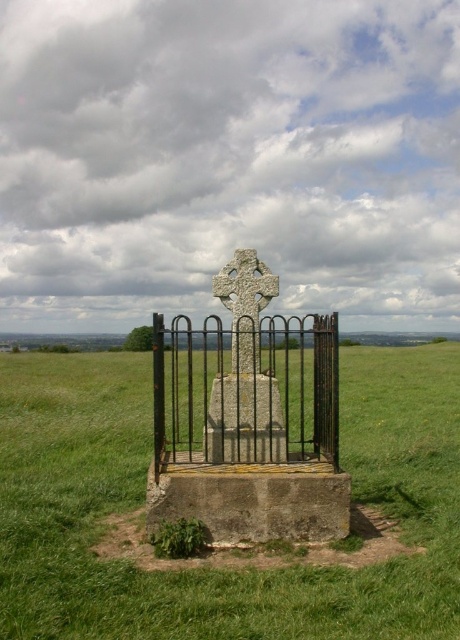
Question: Does black wrought iron fence at center have a smaller size compared to white stone cross at center?

Choices:
 (A) no
 (B) yes

Answer: (A)

Question: Which point is farther to the camera?

Choices:
 (A) (224, 298)
 (B) (444, 348)
 (C) (280, 435)
 (D) (249, 448)

Answer: (B)

Question: Where is smooth stone gravestone at center located in relation to white stone cross at center in the image?

Choices:
 (A) right
 (B) left

Answer: (B)

Question: Can you confirm if black wrought iron fence at center is wider than white stone cross at center?

Choices:
 (A) no
 (B) yes

Answer: (B)

Question: Which point is closer to the camera?

Choices:
 (A) black wrought iron fence at center
 (B) smooth stone gravestone at center
 (C) green grassy at center

Answer: (C)

Question: Which point is farther from the camera taking this photo?

Choices:
 (A) tap(68, 385)
 (B) tap(268, 420)
 (C) tap(249, 310)
 (D) tap(305, 381)

Answer: (D)